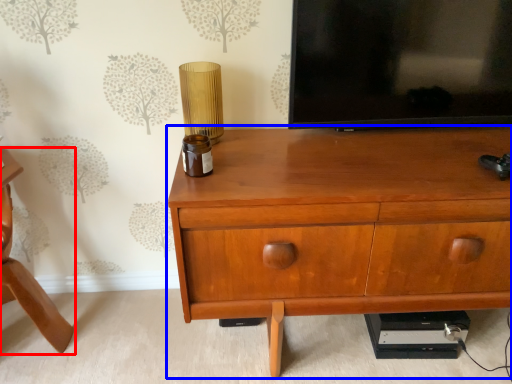
Question: Which of the following is the farthest to the observer, furniture (highlighted by a red box) or chest of drawers (highlighted by a blue box)?

Choices:
 (A) furniture
 (B) chest of drawers

Answer: (A)